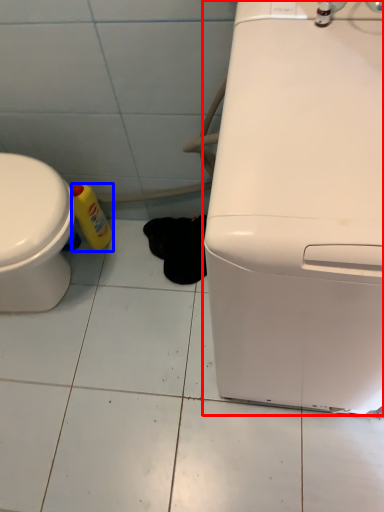
Question: Which of the following is the closest to the observer, home appliance (highlighted by a red box) or bottle (highlighted by a blue box)?

Choices:
 (A) home appliance
 (B) bottle

Answer: (A)